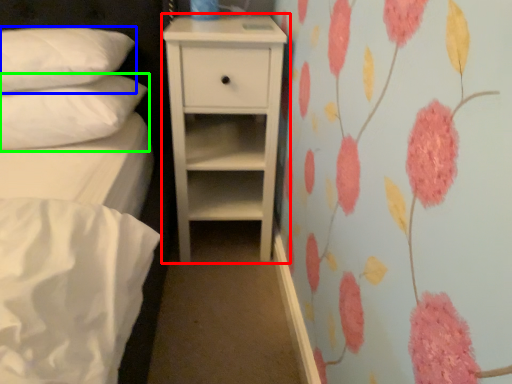
Question: Which is farther away from chest of drawers (highlighted by a red box)? pillow (highlighted by a blue box) or pillow (highlighted by a green box)?

Choices:
 (A) pillow
 (B) pillow

Answer: (A)